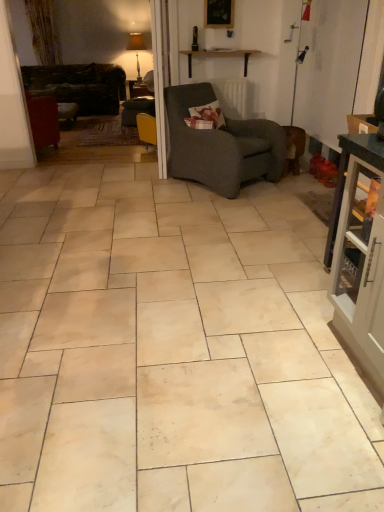
This screenshot has height=512, width=384. In order to click on vacant area in front of dark gray textured armchair at center in this screenshot , I will do `click(241, 213)`.